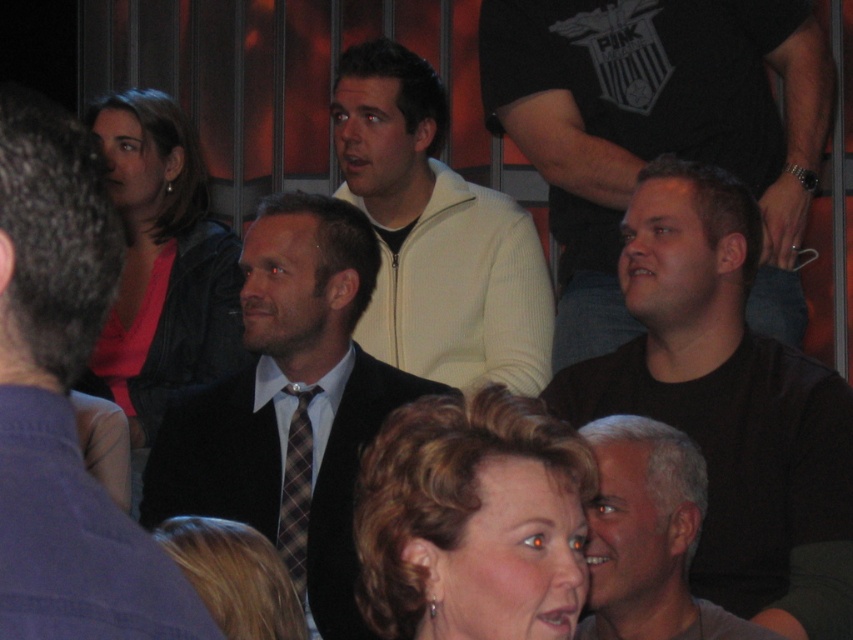
Question: Observing the image, what is the correct spatial positioning of black matte shirt at center in reference to white zip-up sweater at center?

Choices:
 (A) right
 (B) left

Answer: (A)

Question: Considering the real-world distances, which object is farthest from the gray matte shirt at lower right?

Choices:
 (A) dark suit at center
 (B) black matte shirt at right
 (C) smooth black suit at center
 (D) plaid fabric tie at center

Answer: (C)

Question: Does black matte shirt at center lie behind white zip-up sweater at center?

Choices:
 (A) yes
 (B) no

Answer: (B)

Question: Which of the following is the farthest from the observer?

Choices:
 (A) black matte shirt at center
 (B) matte black jacket at center

Answer: (B)

Question: Which point is closer to the camera taking this photo?

Choices:
 (A) (436, 330)
 (B) (164, 596)

Answer: (B)

Question: Can you confirm if blonde hair at center is positioned to the right of plaid fabric tie at center?

Choices:
 (A) no
 (B) yes

Answer: (B)